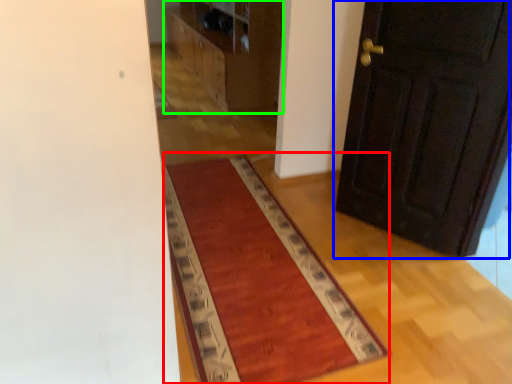
Question: Estimate the real-world distances between objects in this image. Which object is closer to mat (highlighted by a red box), door (highlighted by a blue box) or dresser (highlighted by a green box)?

Choices:
 (A) door
 (B) dresser

Answer: (A)